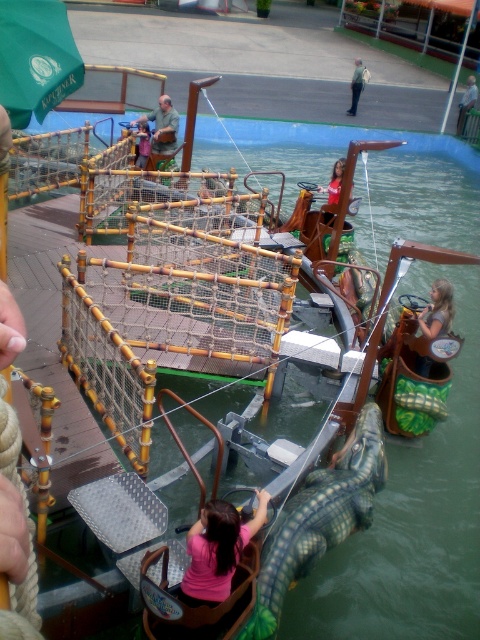
Can you confirm if brown leather jacket at upper center is positioned to the right of pink fabric shirt at center?

Incorrect, brown leather jacket at upper center is not on the right side of pink fabric shirt at center.

Is brown leather jacket at upper center bigger than pink fabric shirt at center?

Yes, brown leather jacket at upper center is bigger than pink fabric shirt at center.

Locate an element on the screen. This screenshot has height=640, width=480. brown leather jacket at upper center is located at coordinates (162, 120).

Where is `brown leather jacket at upper center`? This screenshot has height=640, width=480. brown leather jacket at upper center is located at coordinates (162, 120).

Can you confirm if brown leather jacket at upper center is positioned to the right of matte brown shirt at upper center?

Yes, brown leather jacket at upper center is to the right of matte brown shirt at upper center.

Who is positioned more to the right, brown leather jacket at upper center or matte brown shirt at upper center?

brown leather jacket at upper center is more to the right.

At what (x,y) coordinates should I click in order to perform the action: click on brown leather jacket at upper center. Please return your answer as a coordinate pair (x, y). This screenshot has height=640, width=480. Looking at the image, I should click on (162, 120).

Which is behind, point (187, 547) or point (466, 88)?

Positioned behind is point (466, 88).

Which of these two, pink matte shirt at center or light brown wooden pole at upper right, stands taller?

light brown wooden pole at upper right is taller.

Is point (204, 561) in front of point (463, 108)?

That is True.

Locate an element on the screen. This screenshot has width=480, height=640. pink matte shirt at center is located at coordinates 217,548.